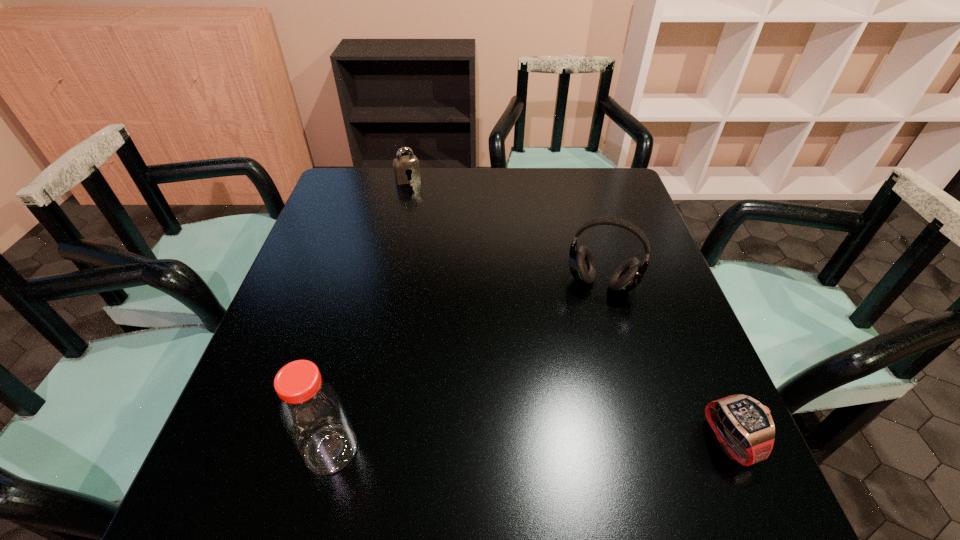
Locate an element on the screen. The height and width of the screenshot is (540, 960). free space that satisfies the following two spatial constraints: 1. on the front side of the shortest object; 2. on the right side of the second shortest object is located at coordinates (350, 441).